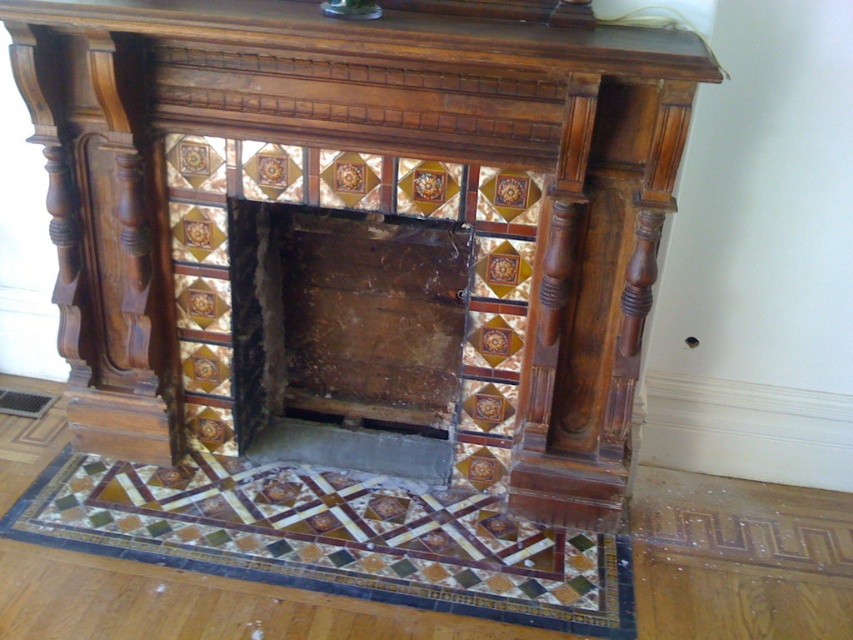
You are an interior designer assessing the fireplace setup. You notice the rusty wood fireplace at center and the polished wood mantle at upper center. Which object is positioned further away from the viewer?

The polished wood mantle at upper center is behind the rusty wood fireplace at center, so it is positioned further away from the viewer.

You are standing in a room with a vintage fireplace. You need to place a decorative item exactly at the center of the room. The rusty wood fireplace at center is already positioned at coordinates point 0.528, 0.407. Can you place your item at the true center of the room without overlapping it?

The rusty wood fireplace at center is located at point (346,337). Since the fireplace is already at the center coordinates, placing another item at the true center would result in overlapping. Therefore, you cannot place your item at the true center without overlapping the rusty wood fireplace at center.

You are standing in front of the vintage fireplace and want to step onto the mosaic tile floor at lower center. What coordinates should you aim for to step onto it?

The mosaic tile floor at lower center is located at coordinates point (334, 540).